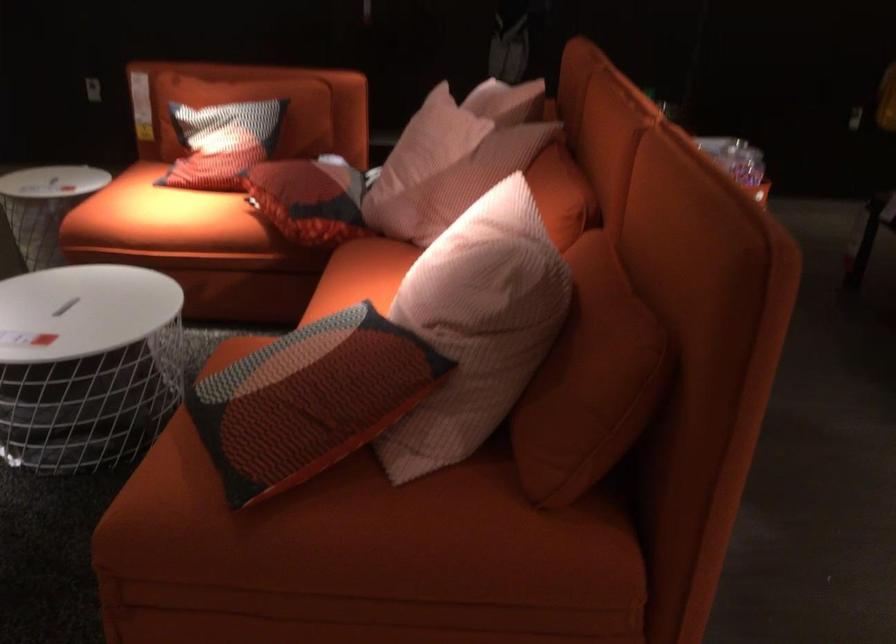
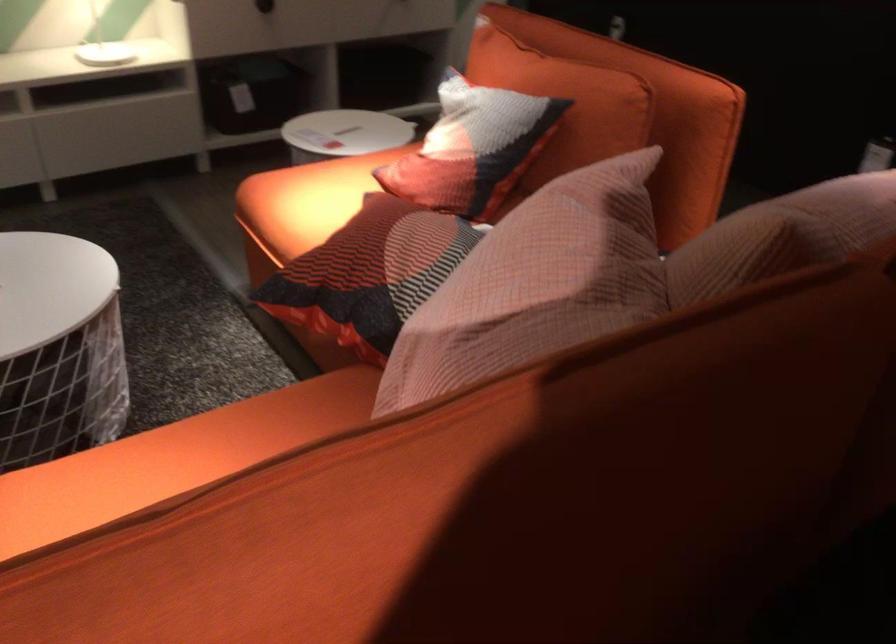
Where in the second image is the point corresponding to the point at 324,193 from the first image?

(369, 274)